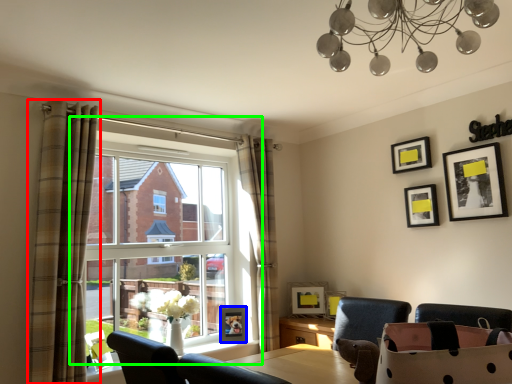
Question: Estimate the real-world distances between objects in this image. Which object is closer to curtain (highlighted by a red box), picture frame (highlighted by a blue box) or window (highlighted by a green box)?

Choices:
 (A) picture frame
 (B) window

Answer: (B)